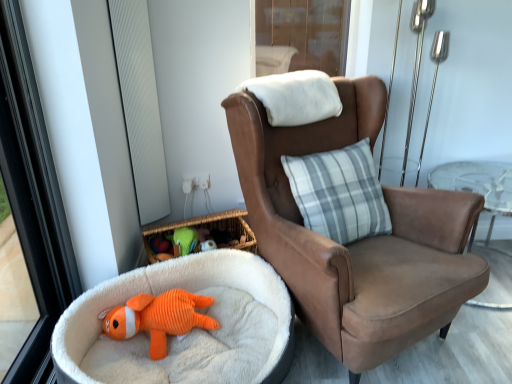
Question: From the image's perspective, is brown suede chair at center on top of green corduroy toy at center, placed as the 1th toy when sorted from back to front?

Choices:
 (A) yes
 (B) no

Answer: (A)

Question: From the image's perspective, does brown suede chair at center appear lower than green corduroy toy at center, placed as the 1th toy when sorted from back to front?

Choices:
 (A) yes
 (B) no

Answer: (B)

Question: Is brown suede chair at center placed right next to green corduroy toy at center, acting as the second toy starting from the bottom?

Choices:
 (A) yes
 (B) no

Answer: (B)

Question: Does brown suede chair at center appear on the right side of green corduroy toy at center, placed as the 2th toy when sorted from front to back?

Choices:
 (A) no
 (B) yes

Answer: (B)

Question: Is brown suede chair at center outside of green corduroy toy at center, placed as the 1th toy when sorted from back to front?

Choices:
 (A) no
 (B) yes

Answer: (B)

Question: From a real-world perspective, does brown suede chair at center sit lower than green corduroy toy at center, placed as the 2th toy when sorted from front to back?

Choices:
 (A) no
 (B) yes

Answer: (A)

Question: Considering the relative sizes of white textured window screen at left and orange corduroy fish at lower left, arranged as the first toy when viewed from the front, in the image provided, is white textured window screen at left thinner than orange corduroy fish at lower left, arranged as the first toy when viewed from the front,?

Choices:
 (A) no
 (B) yes

Answer: (B)

Question: Can you confirm if white textured window screen at left is wider than orange corduroy fish at lower left, marked as the second toy in a top-to-bottom arrangement?

Choices:
 (A) no
 (B) yes

Answer: (A)

Question: Is the depth of white textured window screen at left less than that of orange corduroy fish at lower left, marked as the second toy in a top-to-bottom arrangement?

Choices:
 (A) no
 (B) yes

Answer: (A)

Question: Is white textured window screen at left to the right of orange corduroy fish at lower left, arranged as the first toy when viewed from the front, from the viewer's perspective?

Choices:
 (A) no
 (B) yes

Answer: (A)

Question: Considering the relative sizes of white textured window screen at left and orange corduroy fish at lower left, arranged as the 1th toy when ordered from the bottom, in the image provided, is white textured window screen at left smaller than orange corduroy fish at lower left, arranged as the 1th toy when ordered from the bottom,?

Choices:
 (A) yes
 (B) no

Answer: (A)

Question: Can you confirm if white textured window screen at left is bigger than orange corduroy fish at lower left, which ranks as the second toy in back-to-front order?

Choices:
 (A) no
 (B) yes

Answer: (A)

Question: Does transparent glass screen door at upper center lie behind brown suede chair at center?

Choices:
 (A) yes
 (B) no

Answer: (A)